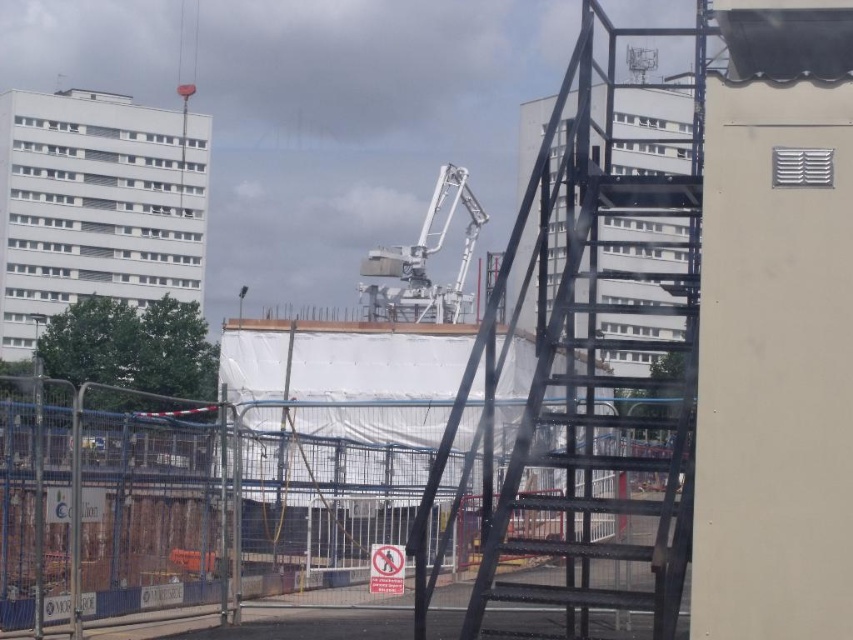
Who is lower down, blue metal fence at center or black metal ladder at center?

blue metal fence at center

Who is more distant from viewer, (x=651, y=634) or (x=518, y=236)?

Positioned behind is point (x=651, y=634).

Locate an element on the screen. The width and height of the screenshot is (853, 640). blue metal fence at center is located at coordinates (285, 513).

Where is `blue metal fence at center`? The image size is (853, 640). blue metal fence at center is located at coordinates (285, 513).